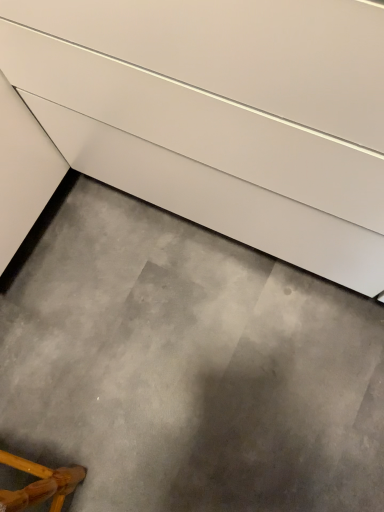
The width and height of the screenshot is (384, 512). Describe the element at coordinates (221, 115) in the screenshot. I see `white glossy drawer at upper center` at that location.

Locate an element on the screen. The image size is (384, 512). wooden chair at lower left is located at coordinates (40, 484).

Describe the element at coordinates (40, 484) in the screenshot. I see `wooden chair at lower left` at that location.

Where is `white glossy drawer at upper center`? white glossy drawer at upper center is located at coordinates (221, 115).

Does gray concrete at lower center have a greater height compared to white glossy drawer at upper center?

No.

Considering the sizes of gray concrete at lower center and white glossy drawer at upper center in the image, is gray concrete at lower center wider or thinner than white glossy drawer at upper center?

gray concrete at lower center is wider than white glossy drawer at upper center.

Identify the location of stairs above the gray concrete at lower center (from a real-world perspective). (221, 115).

Which point is more distant from viewer, (342, 336) or (274, 39)?

The point (342, 336) is more distant.

How far apart are white glossy drawer at upper center and gray concrete at lower center?

white glossy drawer at upper center and gray concrete at lower center are 44.41 centimeters apart from each other.

Considering the relative sizes of white glossy drawer at upper center and gray concrete at lower center in the image provided, is white glossy drawer at upper center wider than gray concrete at lower center?

No.

Visually, is white glossy drawer at upper center positioned to the left or to the right of gray concrete at lower center?

From the image, it's evident that white glossy drawer at upper center is to the right of gray concrete at lower center.

Is wooden chair at lower left smaller than white glossy drawer at upper center?

Yes.

Between wooden chair at lower left and white glossy drawer at upper center, which one has more height?

white glossy drawer at upper center is taller.

Is white glossy drawer at upper center completely or partially inside wooden chair at lower left?

No, white glossy drawer at upper center is not surrounded by wooden chair at lower left.

Does wooden chair at lower left turn towards gray concrete at lower center?

No, wooden chair at lower left is not oriented towards gray concrete at lower center.

Is wooden chair at lower left not within gray concrete at lower center?

Yes, wooden chair at lower left is not within gray concrete at lower center.

How many degrees apart are the facing directions of wooden chair at lower left and gray concrete at lower center?

99.9 degrees.

Is wooden chair at lower left to the left of gray concrete at lower center from the viewer's perspective?

Yes, wooden chair at lower left is to the left of gray concrete at lower center.

From a real-world perspective, does gray concrete at lower center sit lower than wooden chair at lower left?

Yes, from a real-world perspective, gray concrete at lower center is beneath wooden chair at lower left.

Between gray concrete at lower center and wooden chair at lower left, which one has larger width?

gray concrete at lower center.

Is gray concrete at lower center taller than wooden chair at lower left?

No.

Would you say gray concrete at lower center contains wooden chair at lower left?

No, wooden chair at lower left is not inside gray concrete at lower center.

Is white glossy drawer at upper center not within wooden chair at lower left?

Yes.

In the image, there is a white glossy drawer at upper center. Identify the location of furniture below it (from a real-world perspective). (40, 484).

From their relative heights in the image, would you say white glossy drawer at upper center is taller or shorter than wooden chair at lower left?

Clearly, white glossy drawer at upper center is taller compared to wooden chair at lower left.

Are white glossy drawer at upper center and wooden chair at lower left far apart?

No.

You are a GUI agent. You are given a task and a screenshot of the screen. Output one action in this format:
    pyautogui.click(x=<x>, y=<y>)
    Task: Click on the stairs that is above the gray concrete at lower center (from the image's perspective)
    This screenshot has height=512, width=384.
    Given the screenshot: What is the action you would take?
    pyautogui.click(x=221, y=115)

Identify the location of stairs that appears above the gray concrete at lower center (from a real-world perspective). (221, 115).

Which object lies further to the anchor point gray concrete at lower center, white glossy drawer at upper center or wooden chair at lower left?

Among the two, white glossy drawer at upper center is located further to gray concrete at lower center.

When comparing their distances from white glossy drawer at upper center, does gray concrete at lower center or wooden chair at lower left seem further?

Based on the image, wooden chair at lower left appears to be further to white glossy drawer at upper center.

Estimate the real-world distances between objects in this image. Which object is further from white glossy drawer at upper center, wooden chair at lower left or gray concrete at lower center?

wooden chair at lower left is further to white glossy drawer at upper center.

Estimate the real-world distances between objects in this image. Which object is further from wooden chair at lower left, white glossy drawer at upper center or gray concrete at lower center?

Among the two, white glossy drawer at upper center is located further to wooden chair at lower left.

Considering their positions, is gray concrete at lower center positioned closer to wooden chair at lower left than white glossy drawer at upper center?

Among the two, gray concrete at lower center is located nearer to wooden chair at lower left.

Which object lies nearer to the anchor point gray concrete at lower center, wooden chair at lower left or white glossy drawer at upper center?

Based on the image, wooden chair at lower left appears to be nearer to gray concrete at lower center.

Where is `concrete between white glossy drawer at upper center and wooden chair at lower left in the up-down direction`? The width and height of the screenshot is (384, 512). concrete between white glossy drawer at upper center and wooden chair at lower left in the up-down direction is located at coordinates (188, 368).